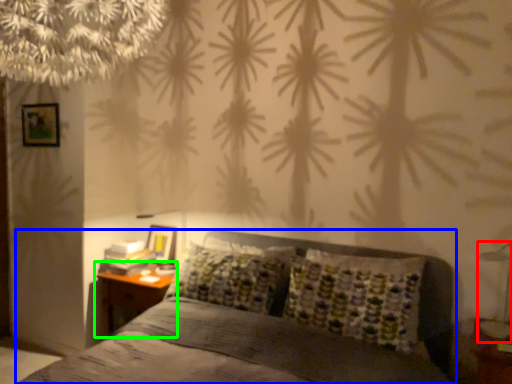
Question: Which object is the closest to the bedside lamp (highlighted by a red box)? Choose among these: bed (highlighted by a blue box) or nightstand (highlighted by a green box).

Choices:
 (A) bed
 (B) nightstand

Answer: (A)